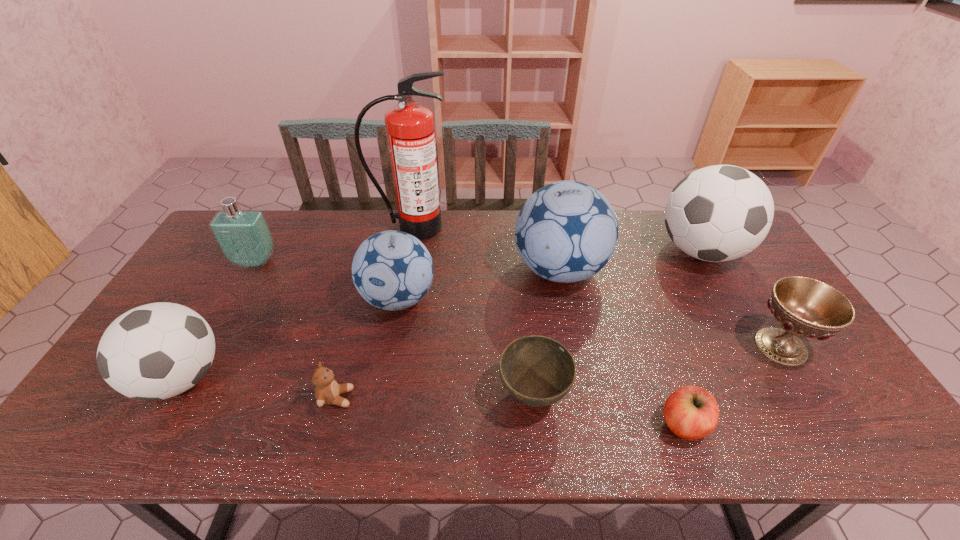
Identify the location of fire extinguisher. (410, 130).

Where is `the tallest object`? This screenshot has height=540, width=960. the tallest object is located at coordinates (410, 130).

Where is `the rightmost soccer ball`? Image resolution: width=960 pixels, height=540 pixels. the rightmost soccer ball is located at coordinates (718, 213).

You are a GUI agent. You are given a task and a screenshot of the screen. Output one action in this format:
    pyautogui.click(x=<x>, y=<y>)
    Task: Click on the bigger black soccer ball
    
    Given the screenshot: What is the action you would take?
    pyautogui.click(x=718, y=213)

Locate an element on the screen. The width and height of the screenshot is (960, 540). the right blue soccer ball is located at coordinates (567, 231).

The height and width of the screenshot is (540, 960). What are the coordinates of `the third soccer ball from left to right` in the screenshot? It's located at (567, 231).

Where is `perfume`? Image resolution: width=960 pixels, height=540 pixels. perfume is located at coordinates pos(243,236).

Image resolution: width=960 pixels, height=540 pixels. Find the location of `the third soccer ball from right to left`. the third soccer ball from right to left is located at coordinates (392, 270).

The height and width of the screenshot is (540, 960). I want to click on the left blue soccer ball, so click(392, 270).

You are a GUI agent. You are given a task and a screenshot of the screen. Output one action in this format:
    pyautogui.click(x=<x>, y=<y>)
    Task: Click on the nearer black soccer ball
    Image resolution: width=960 pixels, height=540 pixels.
    Given the screenshot: What is the action you would take?
    pyautogui.click(x=156, y=351)